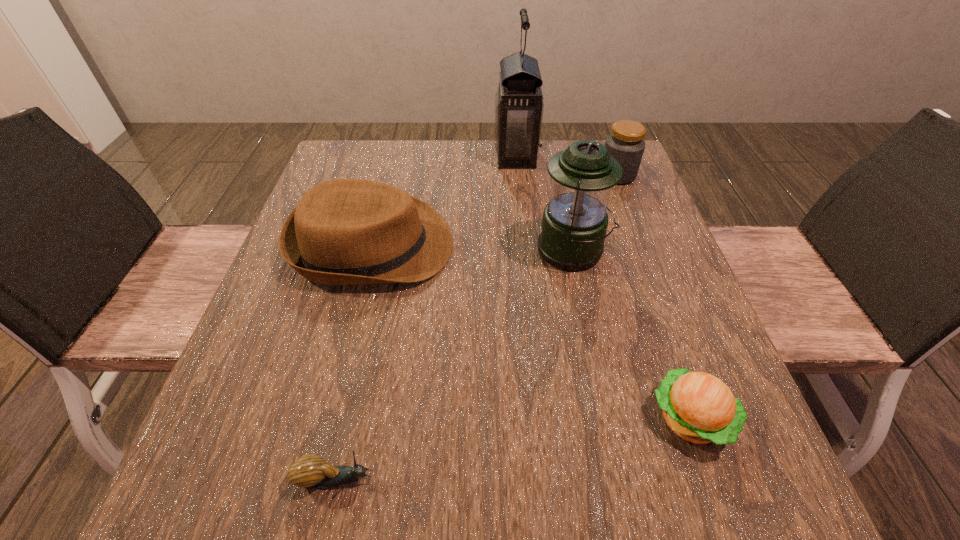
This screenshot has width=960, height=540. Find the location of `object at the far right corner`. object at the far right corner is located at coordinates (625, 144).

Locate an element on the screen. This screenshot has height=540, width=960. object positioned at the near right corner is located at coordinates (700, 408).

Locate an element on the screen. Image resolution: width=960 pixels, height=540 pixels. free location at the far edge of the desktop is located at coordinates (515, 169).

In the image, there is a desktop. Where is `vacant space at the near edge`? This screenshot has height=540, width=960. vacant space at the near edge is located at coordinates (455, 518).

Locate an element on the screen. vacant space at the left edge of the desktop is located at coordinates (280, 271).

Where is `free space at the right edge`? The width and height of the screenshot is (960, 540). free space at the right edge is located at coordinates (657, 267).

In order to click on vacant space at the far left corner in this screenshot , I will do `click(392, 139)`.

Where is `free space between the farther lantern and the escargot`? free space between the farther lantern and the escargot is located at coordinates (426, 317).

Locate an element on the screen. blank region between the escargot and the fedora is located at coordinates (354, 362).

At what (x,y) coordinates should I click in order to perform the action: click on vacant space in between the nearest object and the tallest object. Please return your answer as a coordinate pair (x, y). This screenshot has height=540, width=960. Looking at the image, I should click on (426, 317).